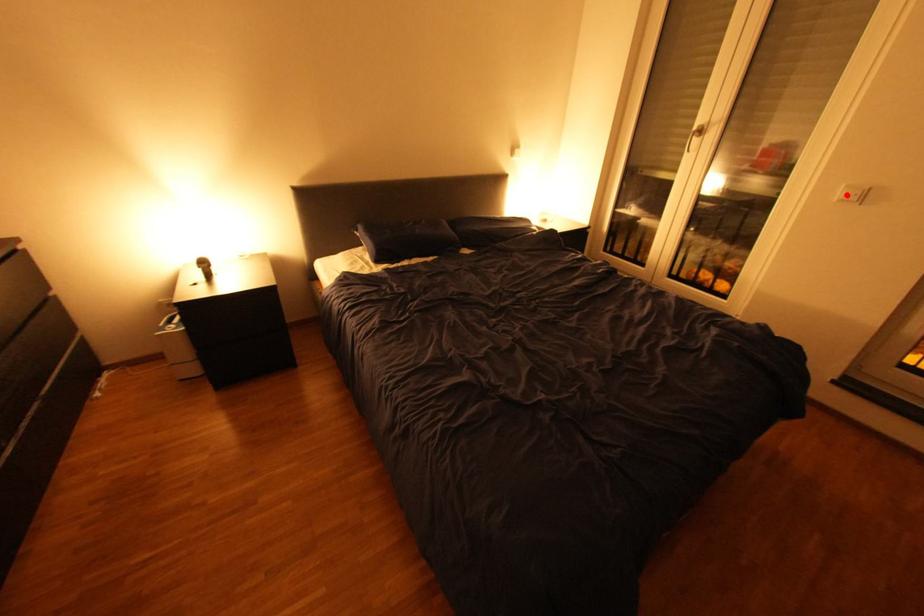
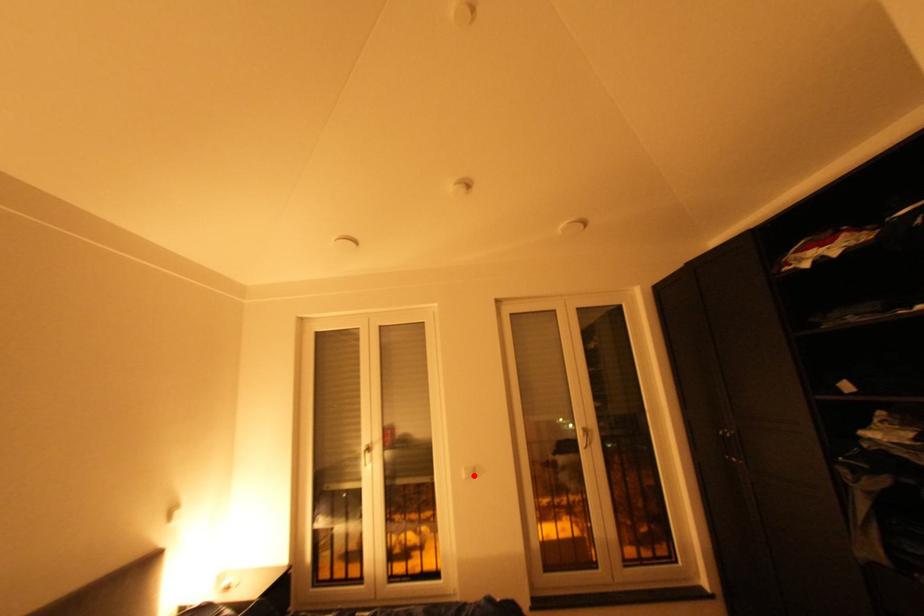
I am providing you with two images of the same scene from different viewpoints. A red point is marked on the first image and another point is marked on the second image. Does the point marked in image1 correspond to the same location as the one in image2?

Yes